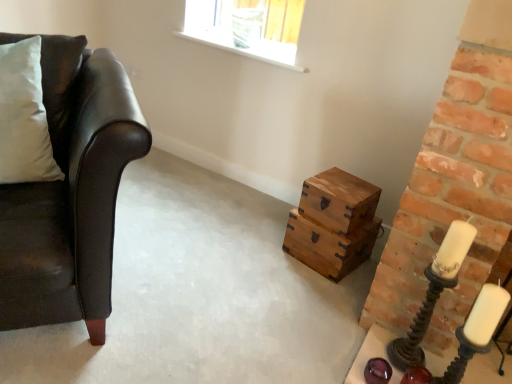
This screenshot has width=512, height=384. I want to click on vacant space that's between matte black leather couch at left and wooden chest at center-right, so click(x=215, y=263).